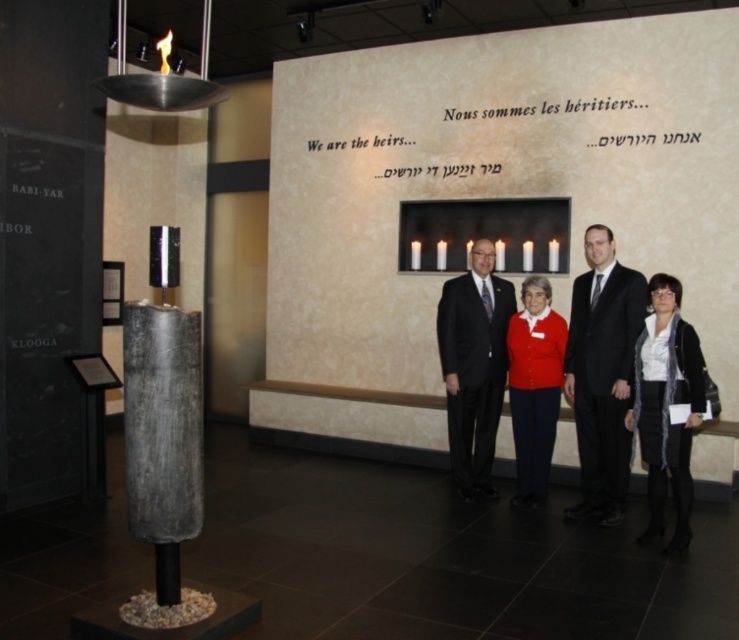
Which is below, black suit at center or matte black suit at center?

black suit at center is lower down.

Is black suit at center taller than matte black suit at center?

Yes, black suit at center is taller than matte black suit at center.

This screenshot has height=640, width=739. Find the location of `black suit at center`. black suit at center is located at coordinates (602, 372).

From the picture: Does matte black suit at center lie in front of black textured scarf at lower right?

No, matte black suit at center is behind black textured scarf at lower right.

Can you confirm if matte black suit at center is taller than black textured scarf at lower right?

Yes, matte black suit at center is taller than black textured scarf at lower right.

At what (x,y) coordinates should I click in order to perform the action: click on matte black suit at center. Please return your answer as a coordinate pair (x, y). The image size is (739, 640). Looking at the image, I should click on (474, 365).

Where is `matte black suit at center`? matte black suit at center is located at coordinates (474, 365).

Is point (636, 321) more distant than point (522, 349)?

No.

Does point (592, 244) come behind point (525, 301)?

No, it is in front of (525, 301).

The height and width of the screenshot is (640, 739). In order to click on black suit at center in this screenshot , I will do `click(602, 372)`.